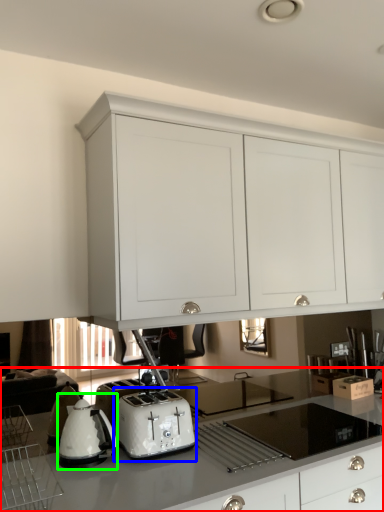
Question: Considering the real-world distances, which object is closest to countertop (highlighted by a red box)? toaster (highlighted by a blue box) or home appliance (highlighted by a green box).

Choices:
 (A) toaster
 (B) home appliance

Answer: (A)